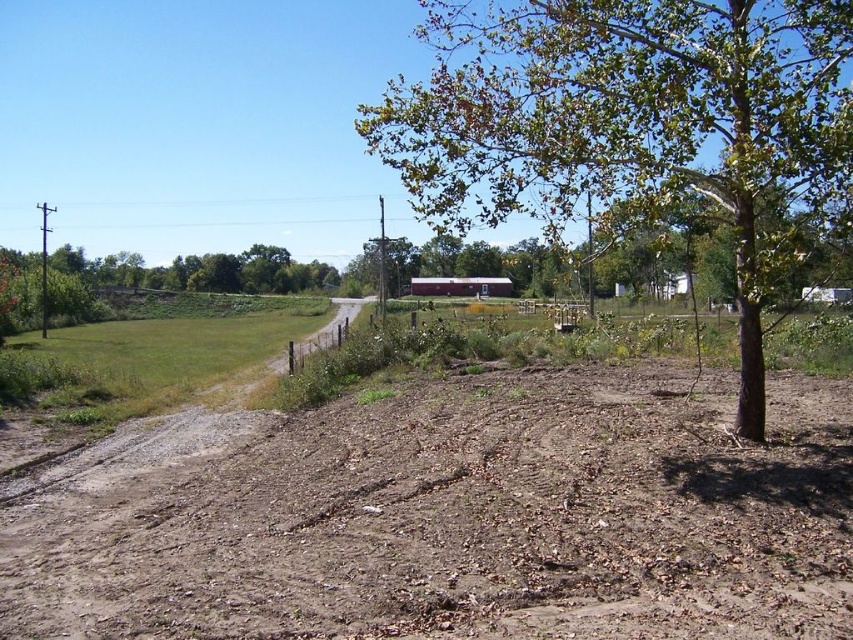
You are a gardener planning to plant flowers in the brown soil at lower center and the green leafy tree at center. Which area has more space available for planting?

The green leafy tree at center has more space available for planting because the brown soil at lower center occupies less space than it.

You are standing at the edge of the dirt path leading to the red barn. You see the brown soil at lower center and the green leafy tree at center. Which object is closer to your left side?

The brown soil at lower center is positioned on the left side of green leafy tree at center, so it is closer to your left side.

You are a gardener planning to plant a new flower bed. You notice the brown soil at lower center and the green leafy tree at center. Which area would you choose for planting flowers, and why?

The brown soil at lower center is thinner than the green leafy tree at center, so the area around the green leafy tree at center has deeper soil which is better for planting flowers.